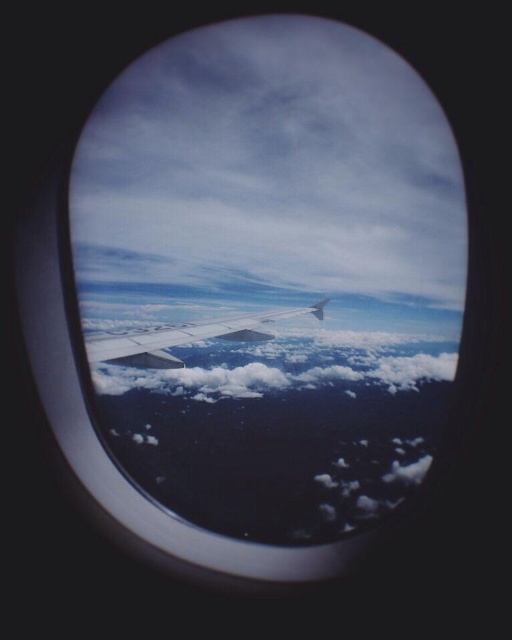
Who is taller, white fluffy cloud at center or metallic silver wing at center?

With more height is white fluffy cloud at center.

Is white fluffy cloud at center shorter than metallic silver wing at center?

No, white fluffy cloud at center is not shorter than metallic silver wing at center.

Does point (273, 358) lie behind point (118, 337)?

Yes, point (273, 358) is farther from viewer.

This screenshot has height=640, width=512. Find the location of `white fluffy cloud at center`. white fluffy cloud at center is located at coordinates (281, 365).